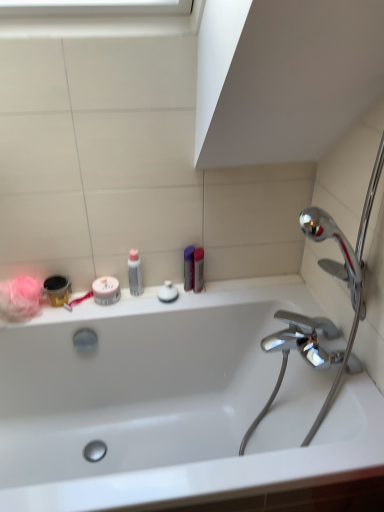
Locate an element on the screen. The width and height of the screenshot is (384, 512). vacant area that is in front of metallic silver toothbrush at left is located at coordinates 66,322.